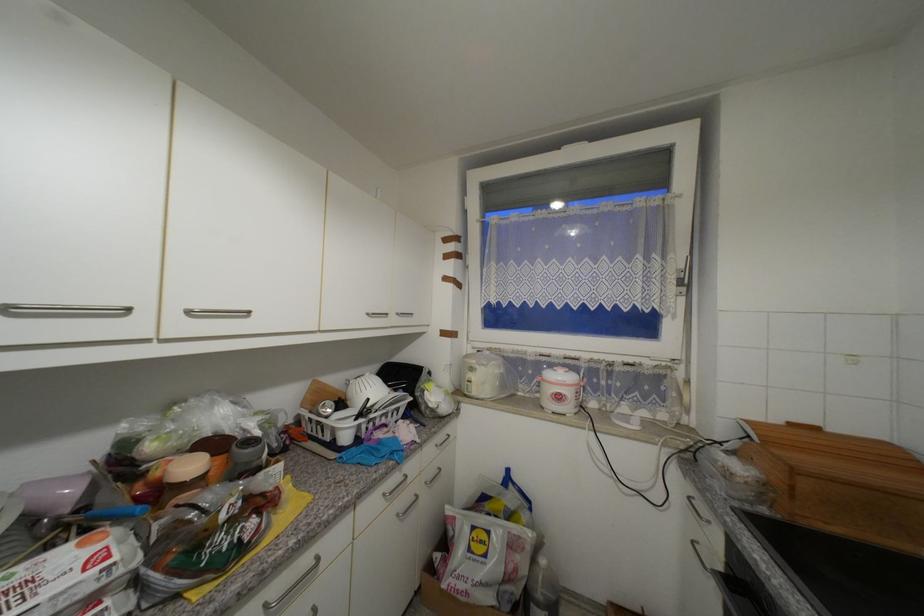
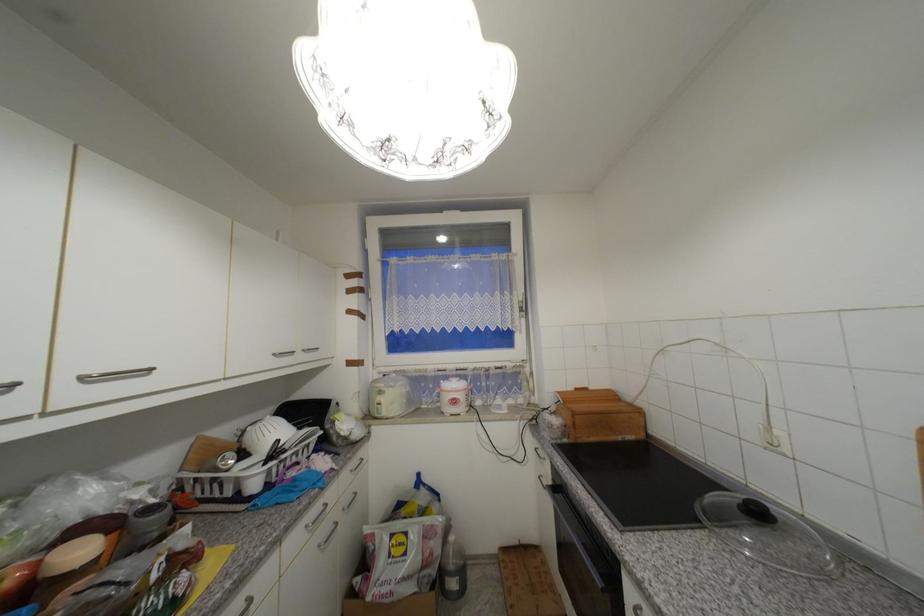
Where in the second image is the point corresponding to point (408, 501) from the first image?

(330, 531)